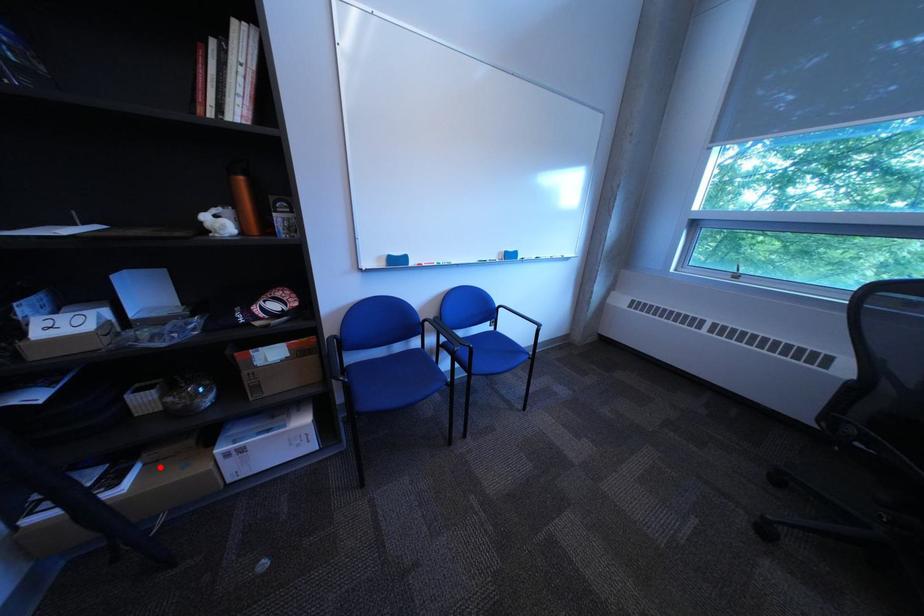
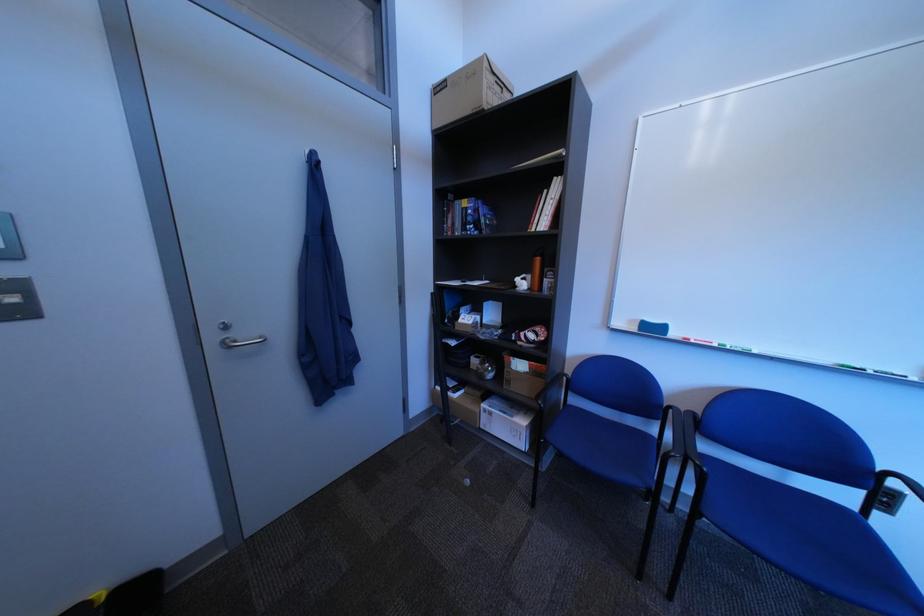
Locate, in the second image, the point that corresponds to the highlighted location in the first image.

(480, 394)